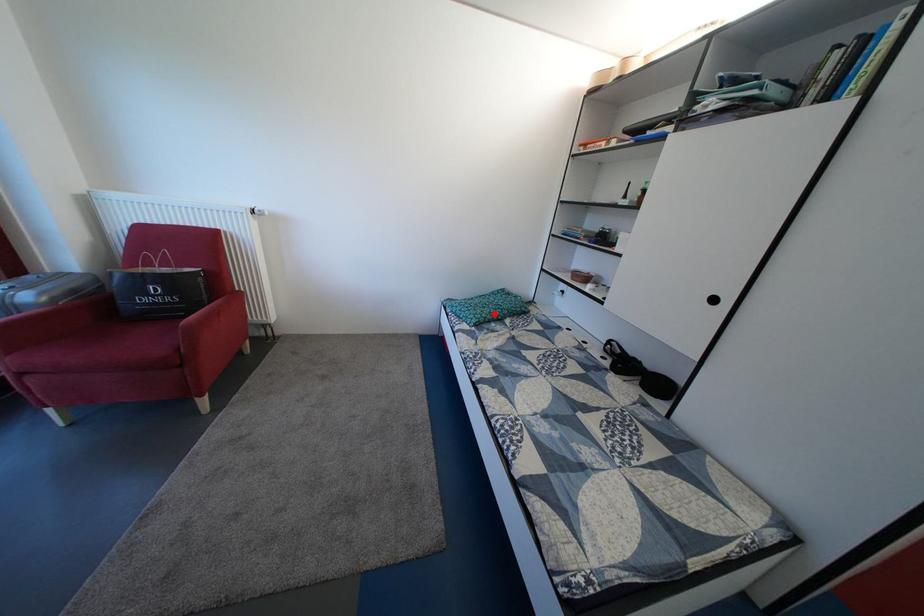
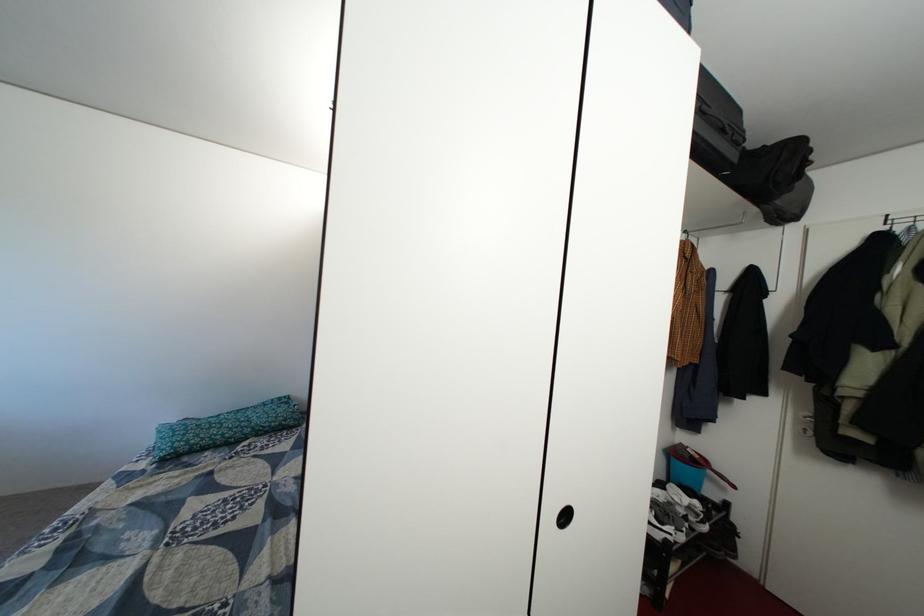
Where in the second image is the point corresponding to the highlighted location from the first image?

(222, 435)